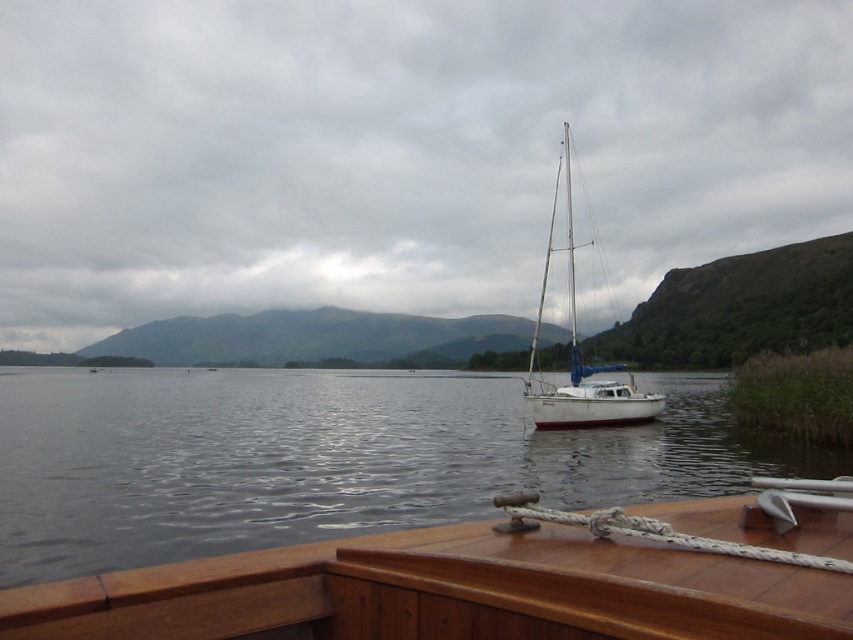
Which is below, clear water at center or white matte sailboat at center?

clear water at center is below.

Find the location of a particular element. clear water at center is located at coordinates (323, 458).

Does wooden deck at center appear under white matte sailboat at center?

Yes, wooden deck at center is below white matte sailboat at center.

Can you confirm if wooden deck at center is positioned to the right of white matte sailboat at center?

No, wooden deck at center is not to the right of white matte sailboat at center.

Who is more forward, (809, 544) or (532, 390)?

Positioned in front is point (809, 544).

Where is `wooden deck at center`? wooden deck at center is located at coordinates (486, 582).

Can you confirm if clear water at center is wider than wooden deck at center?

Yes, clear water at center is wider than wooden deck at center.

Can you confirm if clear water at center is shorter than wooden deck at center?

No.

I want to click on clear water at center, so click(323, 458).